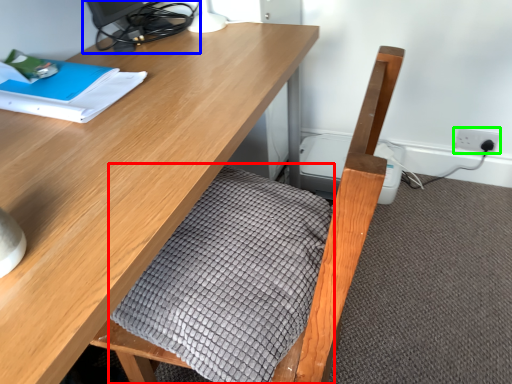
Question: Estimate the real-world distances between objects in this image. Which object is closer to blanket (highlighted by a red box), desktop (highlighted by a blue box) or electric outlet (highlighted by a green box)?

Choices:
 (A) desktop
 (B) electric outlet

Answer: (A)